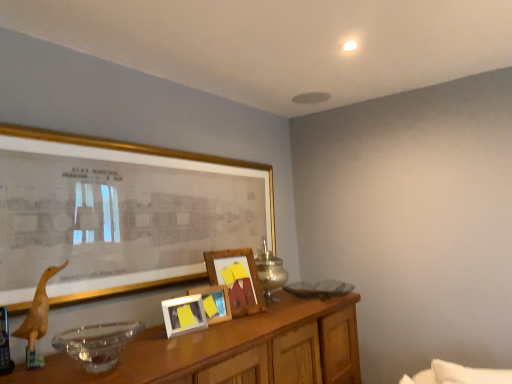
This screenshot has height=384, width=512. Identify the location of vacant space behind wooden duckling at left. (58, 349).